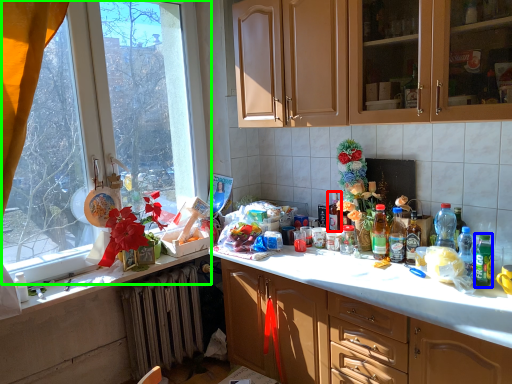
Question: Estimate the real-world distances between objects in this image. Which object is closer to bottle (highlighted by a red box), bottle (highlighted by a blue box) or window (highlighted by a green box)?

Choices:
 (A) bottle
 (B) window

Answer: (A)